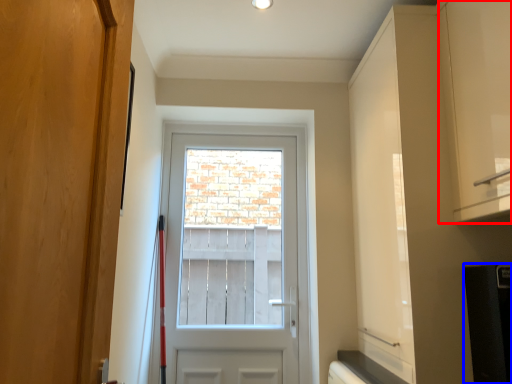
Question: Which object is closer to the camera taking this photo, cabinetry (highlighted by a red box) or appliance (highlighted by a blue box)?

Choices:
 (A) cabinetry
 (B) appliance

Answer: (A)